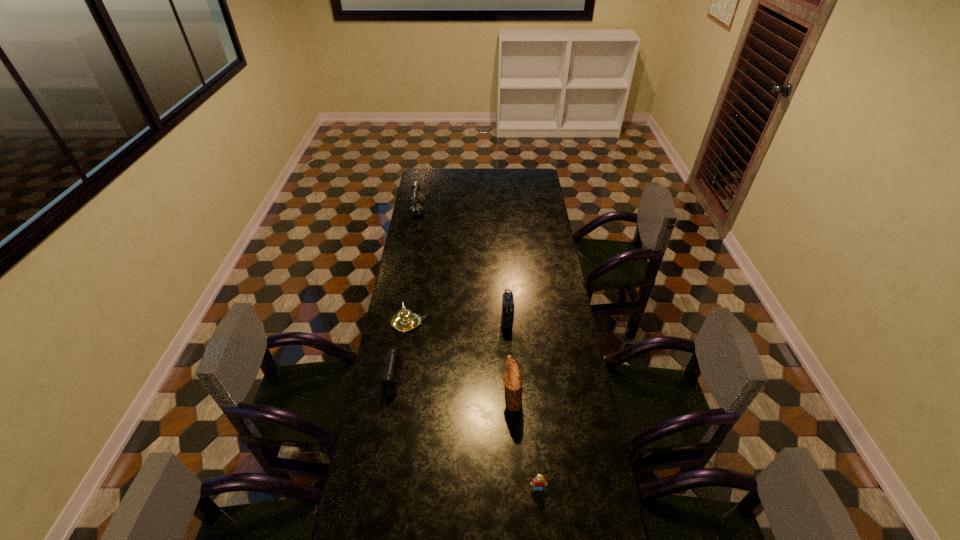
Identify the location of free space in the image that satisfies the following two spatial constraints: 1. with the zip open on the farthest clutch bag; 2. on the handle side of the candle holder. The height and width of the screenshot is (540, 960). (507, 323).